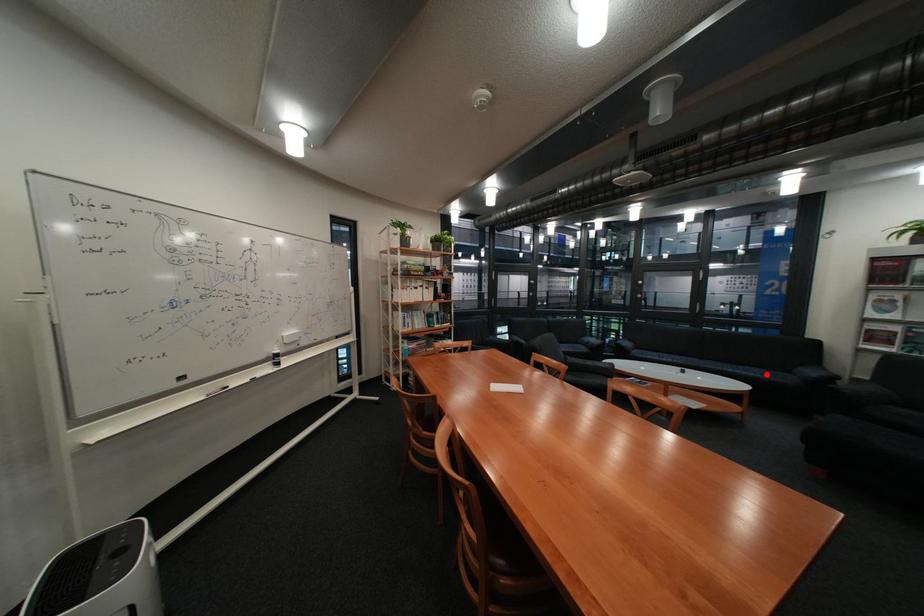
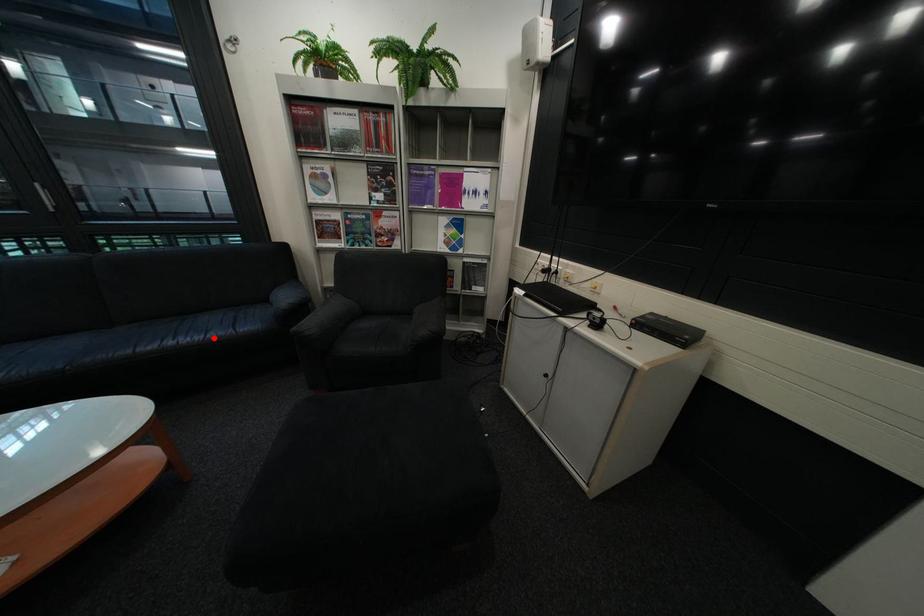
I am providing you with two images of the same scene from different viewpoints. A red point is marked on the first image and another point is marked on the second image. Do the highlighted points in image1 and image2 indicate the same real-world spot?

Yes